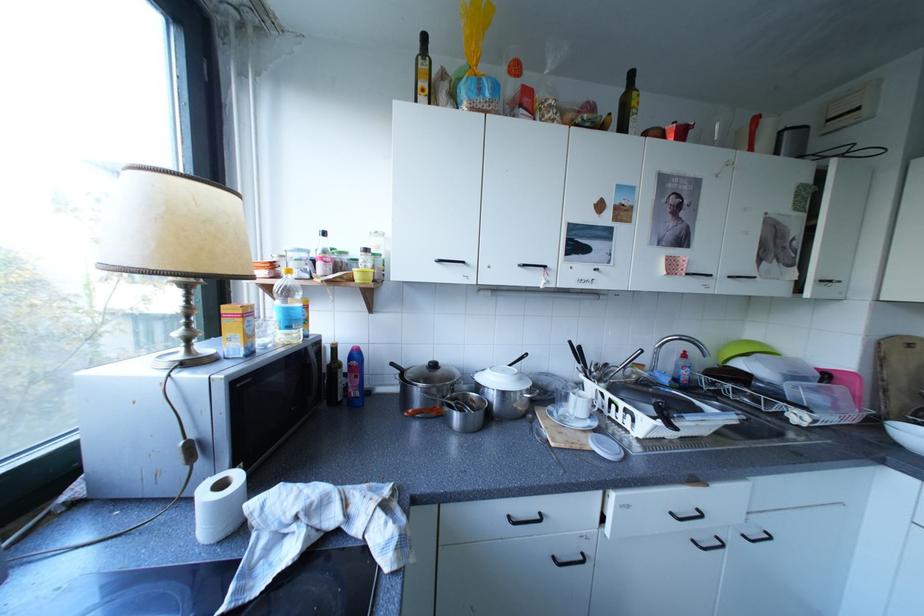
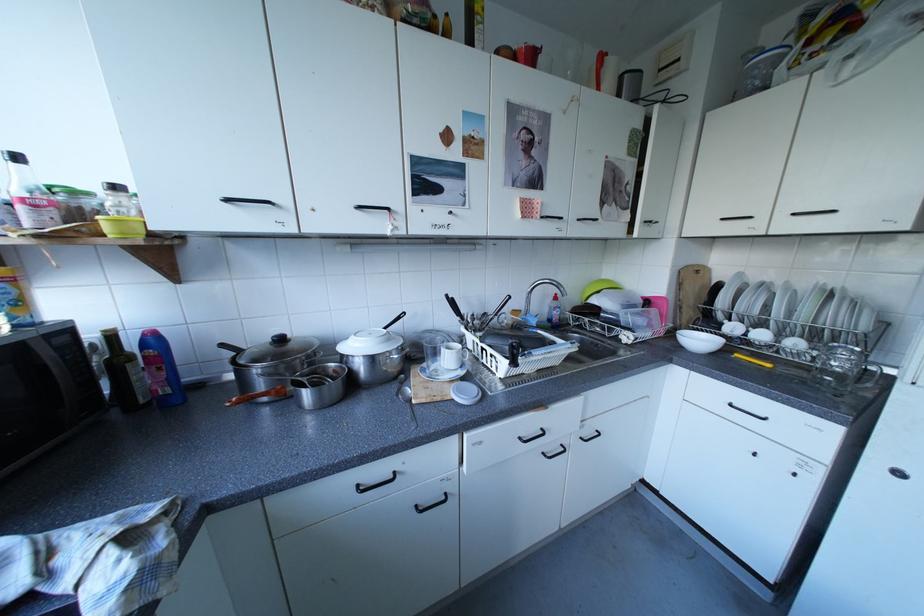
Question: The first image is from the beginning of the video and the second image is from the end. How did the camera likely rotate when shooting the video?

Choices:
 (A) Left
 (B) Right
 (C) Up
 (D) Down

Answer: (B)